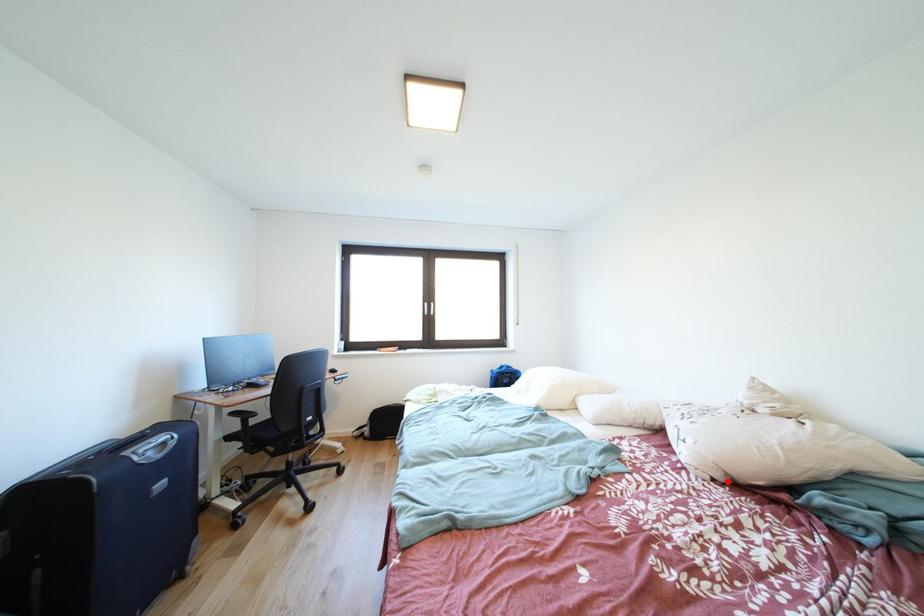
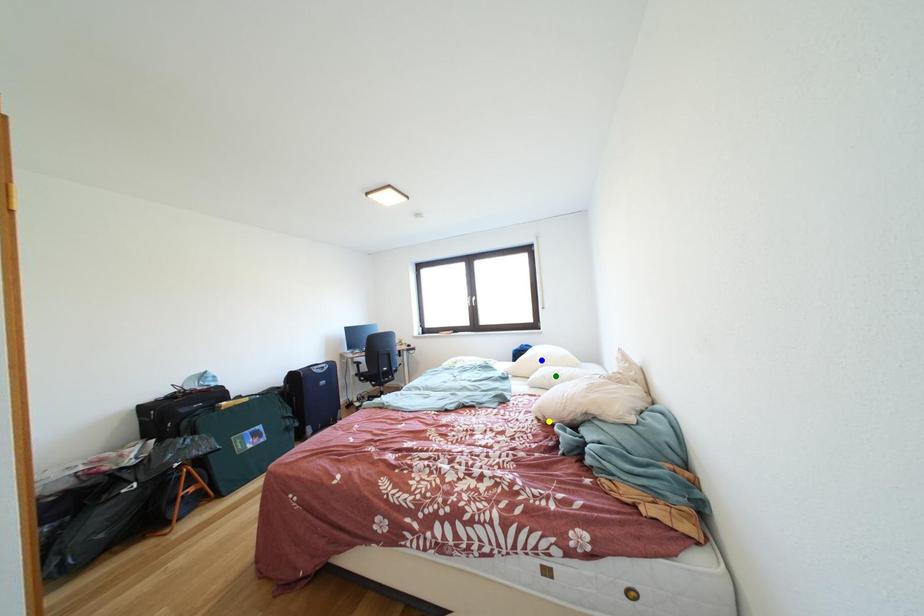
Question: I am providing you with two images of the same scene from different viewpoints. A red point is marked on the first image. You are given multiple points on the second image. Which point in image 2 represents the same 3d spot as the red point in image 1?

Choices:
 (A) yellow point
 (B) green point
 (C) blue point

Answer: (A)